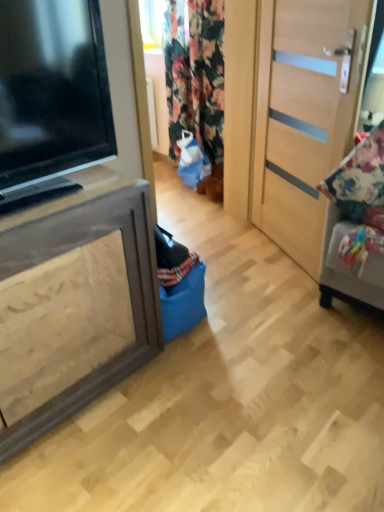
Question: Is brown wood cabinet at left shorter than light wood door at right?

Choices:
 (A) no
 (B) yes

Answer: (B)

Question: From the image's perspective, is brown wood cabinet at left beneath light wood door at right?

Choices:
 (A) no
 (B) yes

Answer: (B)

Question: Is brown wood cabinet at left far from light wood door at right?

Choices:
 (A) yes
 (B) no

Answer: (A)

Question: Can you confirm if brown wood cabinet at left is wider than light wood door at right?

Choices:
 (A) no
 (B) yes

Answer: (B)

Question: Is brown wood cabinet at left turned away from light wood door at right?

Choices:
 (A) yes
 (B) no

Answer: (B)

Question: Is point (327, 164) positioned closer to the camera than point (203, 49)?

Choices:
 (A) farther
 (B) closer

Answer: (B)

Question: Is light wood door at right bigger or smaller than floral fabric curtain at center?

Choices:
 (A) big
 (B) small

Answer: (B)

Question: Is light wood door at right wider or thinner than floral fabric curtain at center?

Choices:
 (A) thin
 (B) wide

Answer: (A)

Question: In terms of height, does light wood door at right look taller or shorter compared to floral fabric curtain at center?

Choices:
 (A) short
 (B) tall

Answer: (B)

Question: Considering the positions of floral fabric cushion at right and black glossy television at left in the image, is floral fabric cushion at right wider or thinner than black glossy television at left?

Choices:
 (A) wide
 (B) thin

Answer: (A)

Question: From a real-world perspective, is floral fabric cushion at right positioned above or below black glossy television at left?

Choices:
 (A) above
 (B) below

Answer: (B)

Question: Considering the positions of point (377, 250) and point (1, 175), is point (377, 250) closer or farther from the camera than point (1, 175)?

Choices:
 (A) closer
 (B) farther

Answer: (B)

Question: Is floral fabric cushion at right in front of or behind black glossy television at left in the image?

Choices:
 (A) front
 (B) behind

Answer: (B)

Question: From their relative heights in the image, would you say black glossy television at left is taller or shorter than floral fabric cushion at right?

Choices:
 (A) tall
 (B) short

Answer: (B)

Question: From a real-world perspective, is black glossy television at left above or below floral fabric cushion at right?

Choices:
 (A) above
 (B) below

Answer: (A)